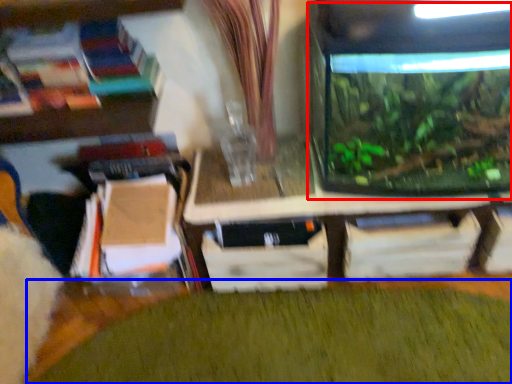
Question: Which of the following is the closest to the observer, glass box (highlighted by a red box) or plant (highlighted by a blue box)?

Choices:
 (A) glass box
 (B) plant

Answer: (A)